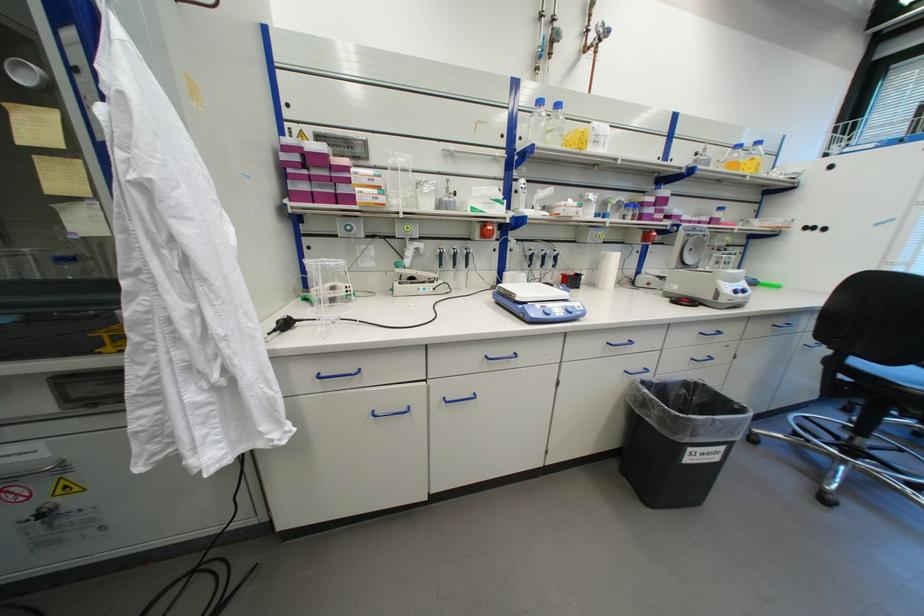
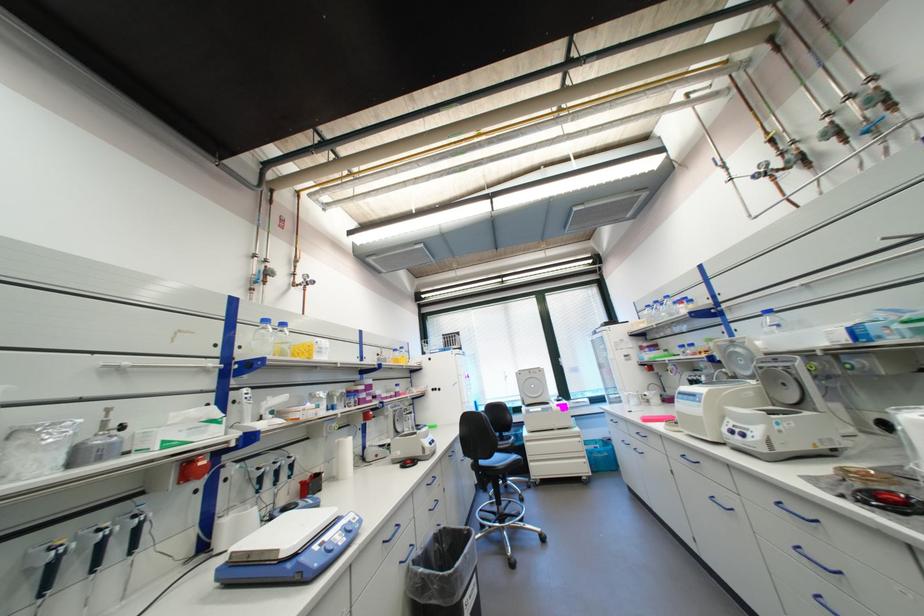
In the second image, find the point that corresponds to (603,267) in the first image.

(339, 458)